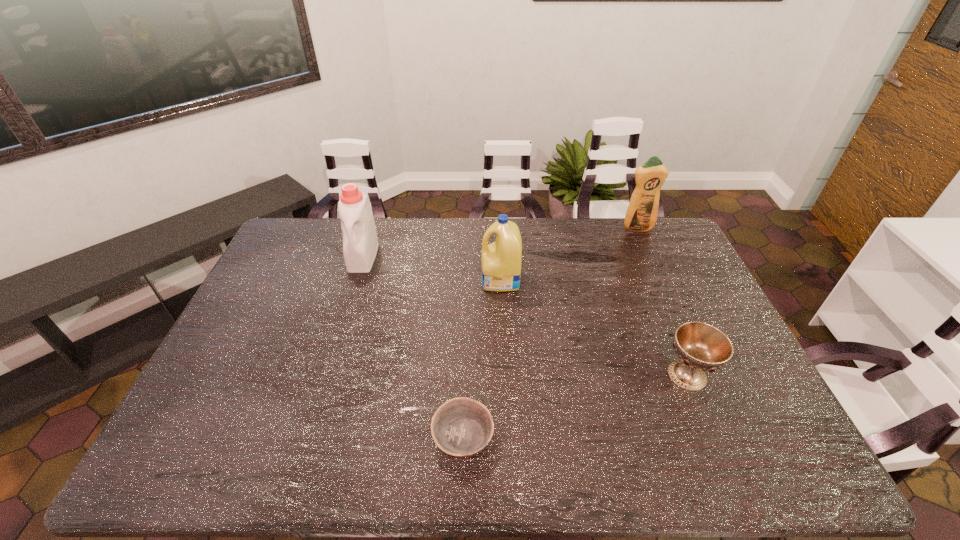
This screenshot has height=540, width=960. In the image, there is a desktop. What are the coordinates of `vacant space at the near edge` in the screenshot? It's located at (360, 469).

Find the location of a particular element. The height and width of the screenshot is (540, 960). vacant space at the left edge of the desktop is located at coordinates (220, 395).

Find the location of a particular element. The height and width of the screenshot is (540, 960). vacant area at the right edge of the desktop is located at coordinates (694, 305).

Identify the location of vacant region at the near left corner. The width and height of the screenshot is (960, 540). (207, 471).

You are a GUI agent. You are given a task and a screenshot of the screen. Output one action in this format:
    pyautogui.click(x=<x>, y=<y>)
    Task: Click on the free location at the far right corner
    Image resolution: width=960 pixels, height=540 pixels.
    Given the screenshot: What is the action you would take?
    pyautogui.click(x=664, y=221)

Locate an element on the screen. free location at the near right corner is located at coordinates (770, 450).

Where is `free space between the rightmost detergent and the second nearest object`? The width and height of the screenshot is (960, 540). free space between the rightmost detergent and the second nearest object is located at coordinates (662, 301).

Find the location of `vacant space that's between the leftmost detergent and the second nearest object`. vacant space that's between the leftmost detergent and the second nearest object is located at coordinates (525, 316).

You are a GUI agent. You are given a task and a screenshot of the screen. Output one action in this format:
    pyautogui.click(x=<x>, y=<y>)
    Task: Click on the free area in between the rightmost detergent and the second detergent from right to left
    
    Given the screenshot: What is the action you would take?
    pyautogui.click(x=569, y=254)

What are the coordinates of `empty location between the second shortest object and the shortest object` in the screenshot? It's located at (575, 406).